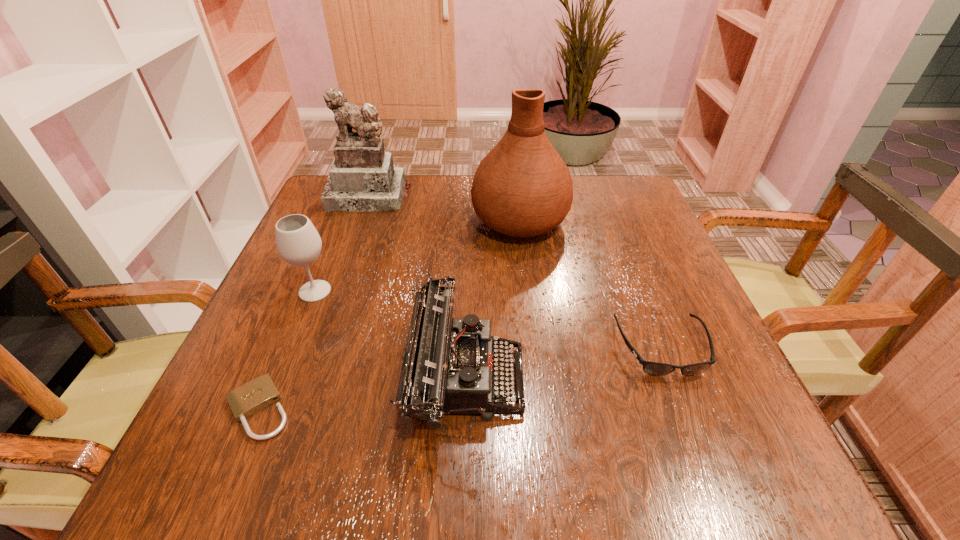
Locate an element on the screen. pitcher is located at coordinates (522, 188).

Find the location of a particular element. Image resolution: width=960 pixels, height=540 pixels. figurine is located at coordinates (362, 177).

Identify the location of wineglass. (298, 243).

Image resolution: width=960 pixels, height=540 pixels. I want to click on the fourth shortest object, so click(298, 243).

Find the location of `the fourth tallest object`. the fourth tallest object is located at coordinates (449, 365).

Identify the location of sunglasses. The height and width of the screenshot is (540, 960). (652, 368).

This screenshot has height=540, width=960. I want to click on the second shortest object, so click(x=652, y=368).

Locate an element on the screen. the shortest object is located at coordinates (254, 396).

This screenshot has width=960, height=540. I want to click on vacant space situated on the front-facing side of the figurine, so click(x=343, y=270).

You are a GUI agent. You are given a task and a screenshot of the screen. Output one action in this format:
    pyautogui.click(x=<x>, y=<y>)
    Task: Click on the vacant space located on the right of the third tallest object
    
    Given the screenshot: What is the action you would take?
    pyautogui.click(x=399, y=291)